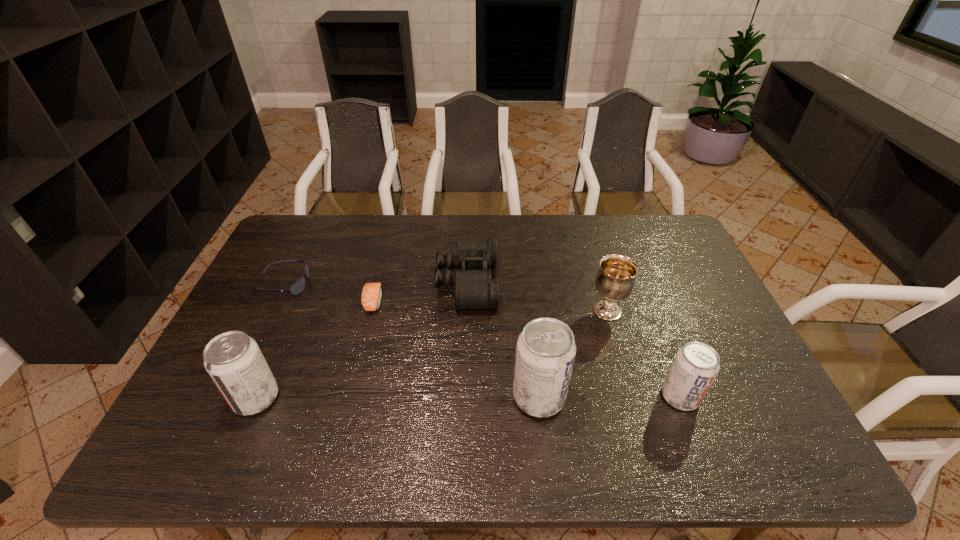
I want to click on blank area located 0.130m on the right of the second soda can from left to right, so click(x=617, y=396).

Locate an element on the screen. The height and width of the screenshot is (540, 960). free space located 0.390m on the left of the rightmost soda can is located at coordinates (504, 396).

Image resolution: width=960 pixels, height=540 pixels. What are the coordinates of `blank area located on the left of the third object from left to right` in the screenshot? It's located at (x=246, y=301).

The width and height of the screenshot is (960, 540). I want to click on vacant space located 0.180m at the eyepieces of the third shortest object, so click(x=553, y=282).

This screenshot has height=540, width=960. What are the coordinates of `vacant area located 0.360m on the lenses of the sunglasses` in the screenshot? It's located at (422, 284).

Locate an element on the screen. The height and width of the screenshot is (540, 960). blank space located 0.280m on the left of the sixth object from left to right is located at coordinates (495, 311).

Locate an element on the screen. The width and height of the screenshot is (960, 540). object at the far edge is located at coordinates (474, 289).

You are a GUI agent. You are given a task and a screenshot of the screen. Output one action in this format:
    pyautogui.click(x=<x>, y=<y>)
    Task: Click on the soda can that is at the left edge
    The image size is (960, 540).
    Given the screenshot: What is the action you would take?
    pyautogui.click(x=234, y=361)

Where is `sunglasses positioned at the left edge`? sunglasses positioned at the left edge is located at coordinates (298, 286).

Find the location of `object located at the near left corner`. object located at the near left corner is located at coordinates [x=234, y=361].